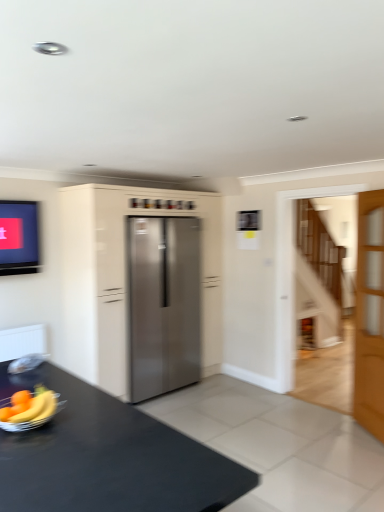
Question: In the image, is black matte table at lower left positioned in front of or behind stainless steel refrigerator at center?

Choices:
 (A) behind
 (B) front

Answer: (B)

Question: In the image, is black matte table at lower left on the left side or the right side of stainless steel refrigerator at center?

Choices:
 (A) left
 (B) right

Answer: (A)

Question: Which object is the farthest from the light brown wooden door at right?

Choices:
 (A) yellow matte banana at lower left
 (B) stainless steel refrigerator at center
 (C) stainless steel refrigerator at center
 (D) black matte table at lower left

Answer: (A)

Question: Which object is the farthest from the light brown wooden door at right?

Choices:
 (A) stainless steel refrigerator at center
 (B) black matte table at lower left
 (C) yellow matte banana at lower left
 (D) stainless steel refrigerator at center

Answer: (C)